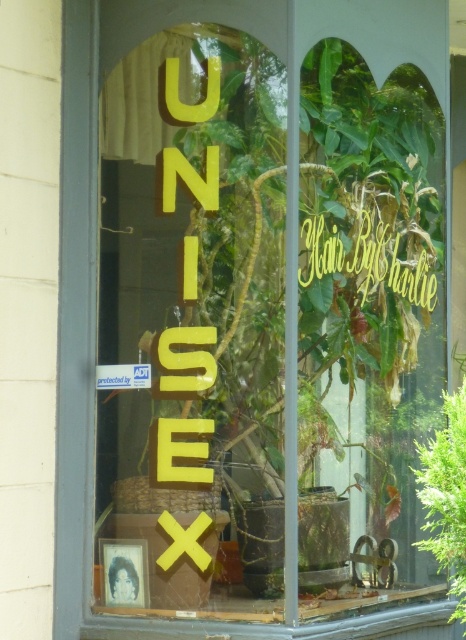
Who is higher up, green leafy plant at right or yellow metallic sign at center?

yellow metallic sign at center is above.

Based on the photo, is green leafy plant at right wider than yellow metallic sign at center?

No, green leafy plant at right is not wider than yellow metallic sign at center.

Is point (458, 397) closer to camera compared to point (398, 268)?

That is True.

This screenshot has height=640, width=466. I want to click on green leafy plant at right, so click(445, 496).